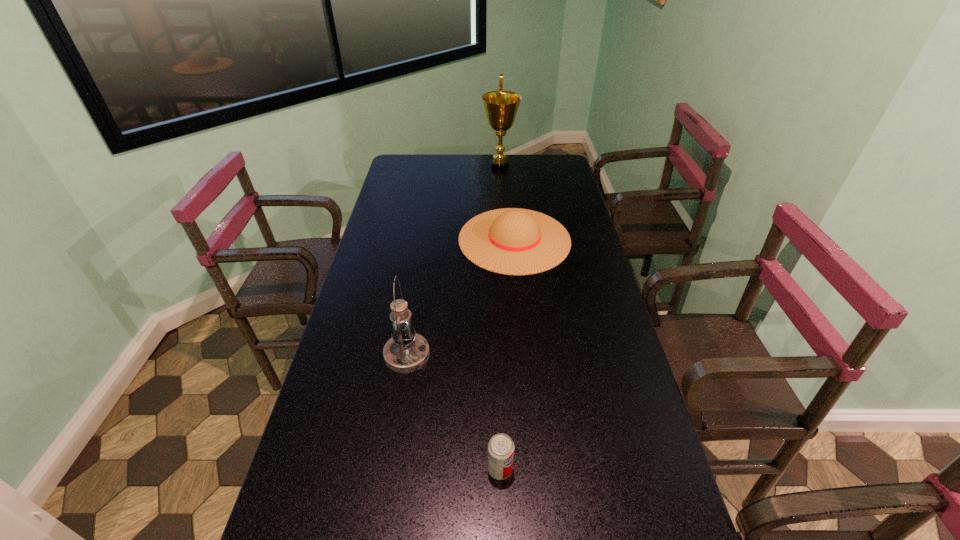
Locate an element on the screen. This screenshot has height=540, width=960. award is located at coordinates (501, 107).

The image size is (960, 540). I want to click on the tallest object, so click(501, 107).

You are a GUI agent. You are given a task and a screenshot of the screen. Output one action in this format:
    pyautogui.click(x=<x>, y=<y>)
    Task: Click on the leftmost object
    
    Given the screenshot: What is the action you would take?
    pyautogui.click(x=406, y=352)

Where is `the third farthest object`? the third farthest object is located at coordinates (406, 352).

The height and width of the screenshot is (540, 960). Identify the location of the third nearest object. (511, 241).

This screenshot has height=540, width=960. What are the coordinates of `soda` in the screenshot? It's located at (x=500, y=447).

Identify the location of vacant space located on the front view with handles of the award. (399, 166).

Where is `vacant space located on the front view with handles of the award`? The image size is (960, 540). vacant space located on the front view with handles of the award is located at coordinates (403, 166).

I want to click on vacant position located on the front view with handles of the award, so click(x=401, y=166).

I want to click on free region located 0.140m on the right of the oil lamp, so click(480, 355).